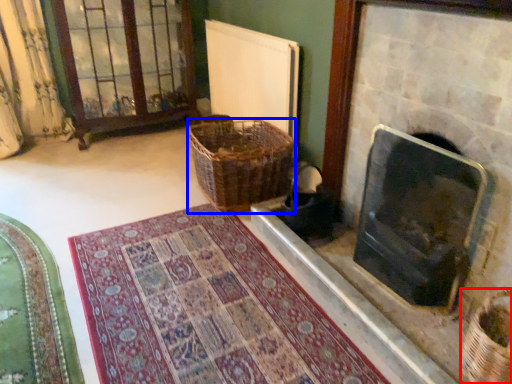
Question: Among these objects, which one is nearest to the camera, basket (highlighted by a red box) or basket (highlighted by a blue box)?

Choices:
 (A) basket
 (B) basket

Answer: (A)